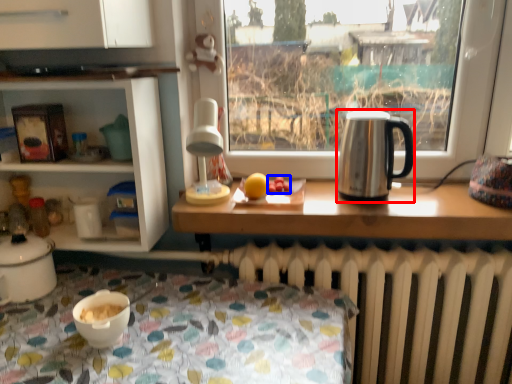
Question: Among these objects, which one is nearest to the camera, kettle (highlighted by a red box) or food (highlighted by a blue box)?

Choices:
 (A) kettle
 (B) food

Answer: (A)